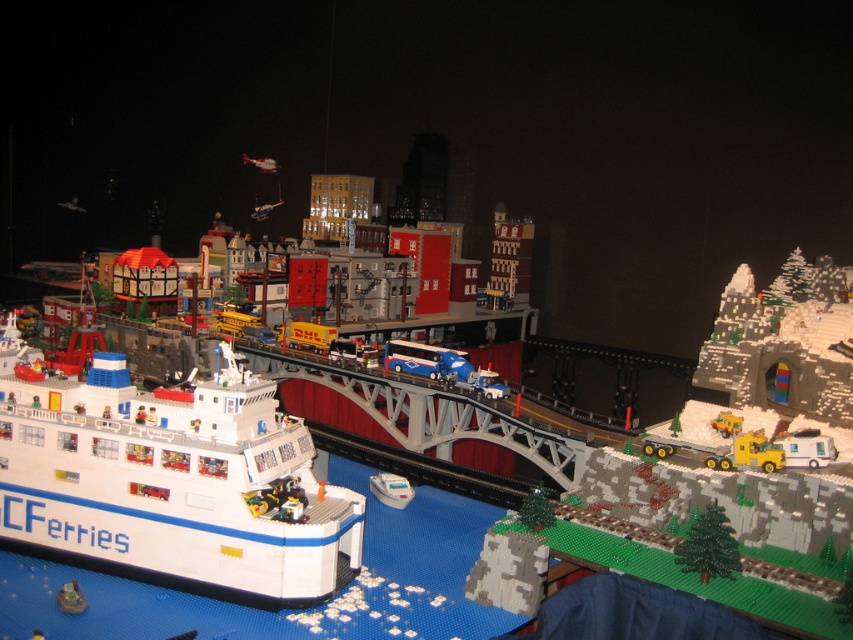
You are a Lego figure standing on the ferry and want to reach the bridge. You see the white plastic boat at lower center and the smooth plastic toy boat at lower left. Which boat is closer to you?

The white plastic boat at lower center is closer to you because the smooth plastic toy boat at lower left is behind it.

You are a Lego figure standing on the ferry and want to compare the size of the blue metallic bus at center and the smooth plastic toy boat at lower left. Which one is wider?

The blue metallic bus at center is wider than the smooth plastic toy boat at lower left.